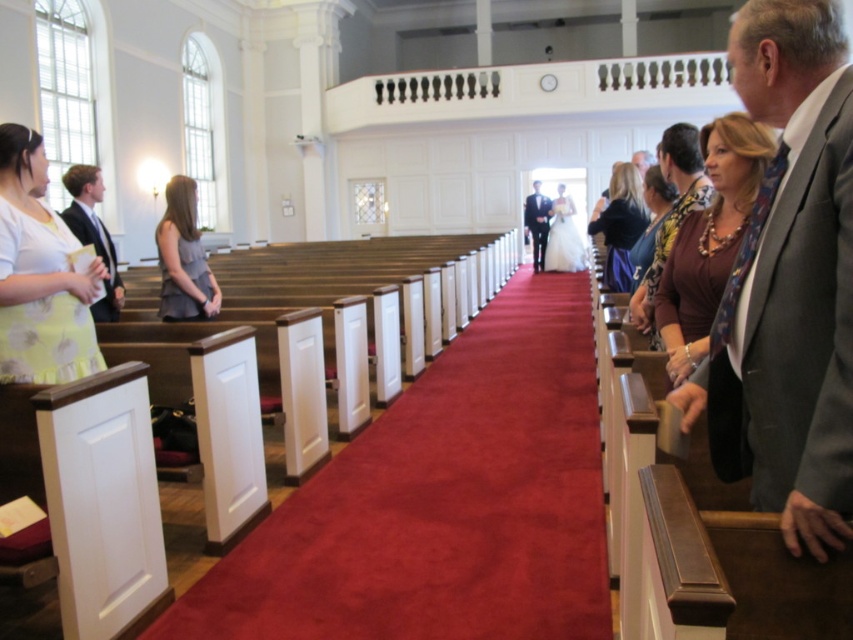
You are a photographer taking pictures of the wedding ceremony. You notice the matte black dress at center and the printed silk blouse at center. Which one is covering the other?

The matte black dress at center is positioned over the printed silk blouse at center, so the matte black dress is covering the printed silk blouse.

You are a photographer standing at the back of the church during a wedding. You need to capture a photo of the matte black dress at center and the velvet red carpet at center. Since the carpet is wider than the dress, how should you position your camera to ensure both are fully visible in the frame?

Position the camera so that the velvet red carpet at center is centered and the matte black dress at center is placed towards the middle of the carpet. Since the carpet is wider, this arrangement ensures both objects fit within the frame without cropping either.